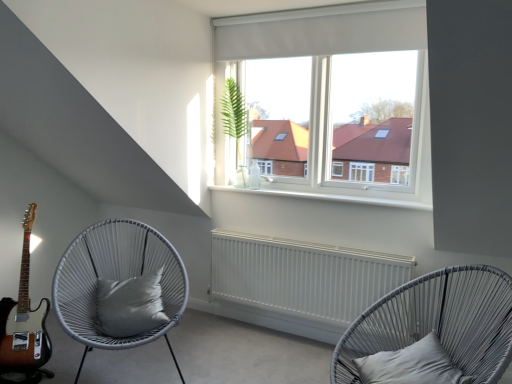
Question: Is the position of white woven chair with cushion at left, the first chair when ordered from left to right, more distant than that of white matte radiator at center?

Choices:
 (A) yes
 (B) no

Answer: (B)

Question: Can we say white woven chair with cushion at left, the first chair when ordered from left to right, lies outside white matte radiator at center?

Choices:
 (A) yes
 (B) no

Answer: (A)

Question: Could you tell me if white woven chair with cushion at left, the first chair when ordered from left to right, is turned towards white matte radiator at center?

Choices:
 (A) no
 (B) yes

Answer: (A)

Question: Considering the relative sizes of white woven chair with cushion at left, the first chair when ordered from left to right, and white matte radiator at center in the image provided, is white woven chair with cushion at left, the first chair when ordered from left to right, shorter than white matte radiator at center?

Choices:
 (A) yes
 (B) no

Answer: (B)

Question: Can you confirm if white woven chair with cushion at left, the first chair when ordered from left to right, is smaller than white matte radiator at center?

Choices:
 (A) no
 (B) yes

Answer: (A)

Question: From a real-world perspective, is green leafy plant at center physically located above or below white matte radiator at center?

Choices:
 (A) below
 (B) above

Answer: (B)

Question: From the image's perspective, is green leafy plant at center above or below white matte radiator at center?

Choices:
 (A) above
 (B) below

Answer: (A)

Question: Is green leafy plant at center taller or shorter than white matte radiator at center?

Choices:
 (A) tall
 (B) short

Answer: (A)

Question: Considering their positions, is green leafy plant at center located in front of or behind white matte radiator at center?

Choices:
 (A) behind
 (B) front

Answer: (A)

Question: Considering the relative positions of sunburst wood guitar at lower left and green leafy plant at center in the image provided, is sunburst wood guitar at lower left to the left or to the right of green leafy plant at center?

Choices:
 (A) left
 (B) right

Answer: (A)

Question: Looking at the image, does sunburst wood guitar at lower left seem bigger or smaller compared to green leafy plant at center?

Choices:
 (A) big
 (B) small

Answer: (A)

Question: In terms of width, does sunburst wood guitar at lower left look wider or thinner when compared to green leafy plant at center?

Choices:
 (A) wide
 (B) thin

Answer: (A)

Question: Choose the correct answer: Is sunburst wood guitar at lower left inside green leafy plant at center or outside it?

Choices:
 (A) outside
 (B) inside

Answer: (A)

Question: Based on their positions, is green leafy plant at center located to the left or right of white matte curtain at upper center?

Choices:
 (A) left
 (B) right

Answer: (A)

Question: From a real-world perspective, is green leafy plant at center physically located above or below white matte curtain at upper center?

Choices:
 (A) above
 (B) below

Answer: (B)